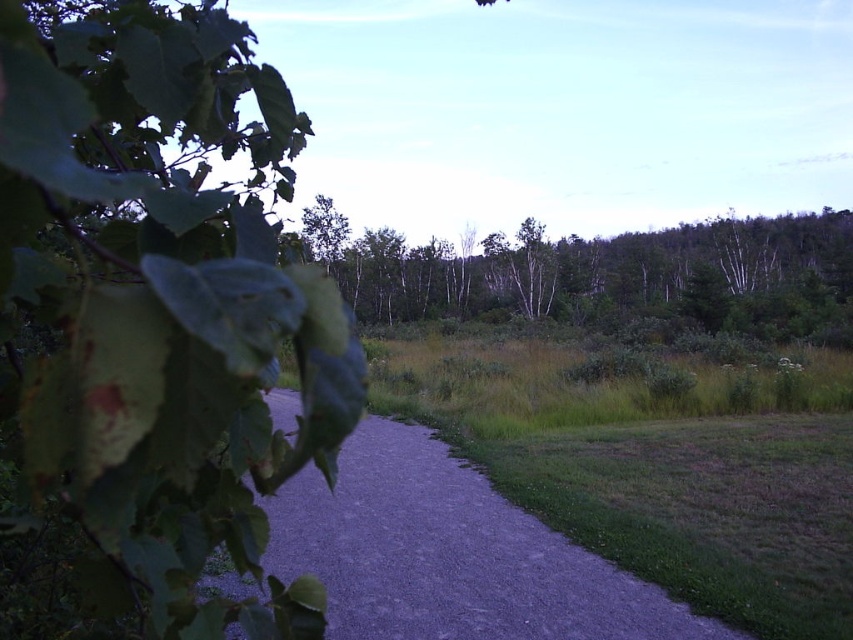
Based on the photo, you are a hiker trying to follow the gray gravel path at center. There are green matte trees at upper center in the distance. Will the trees block your view of the path ahead?

The gray gravel path at center is not as tall as green matte trees at upper center, so the trees will block your view of the path ahead.

You are a hiker trying to navigate through the path in the image. You notice the green leafy tree at left and the green matte trees at upper center. Which of these trees has a narrower width that might allow you to pass through more easily?

The green leafy tree at left has a lesser width compared to the green matte trees at upper center, so it would allow easier passage.